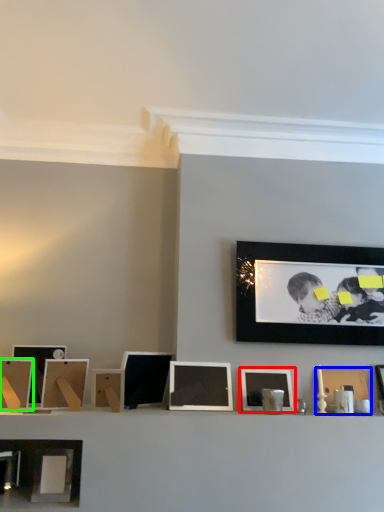
Question: Which object is the closest to the picture frame (highlighted by a red box)? Choose among these: picture frame (highlighted by a blue box) or picture frame (highlighted by a green box).

Choices:
 (A) picture frame
 (B) picture frame

Answer: (A)